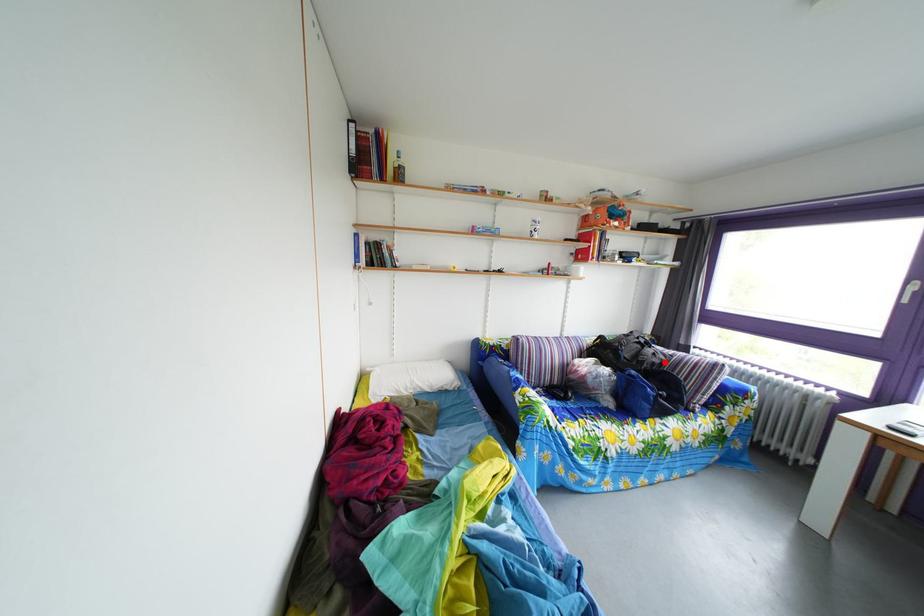
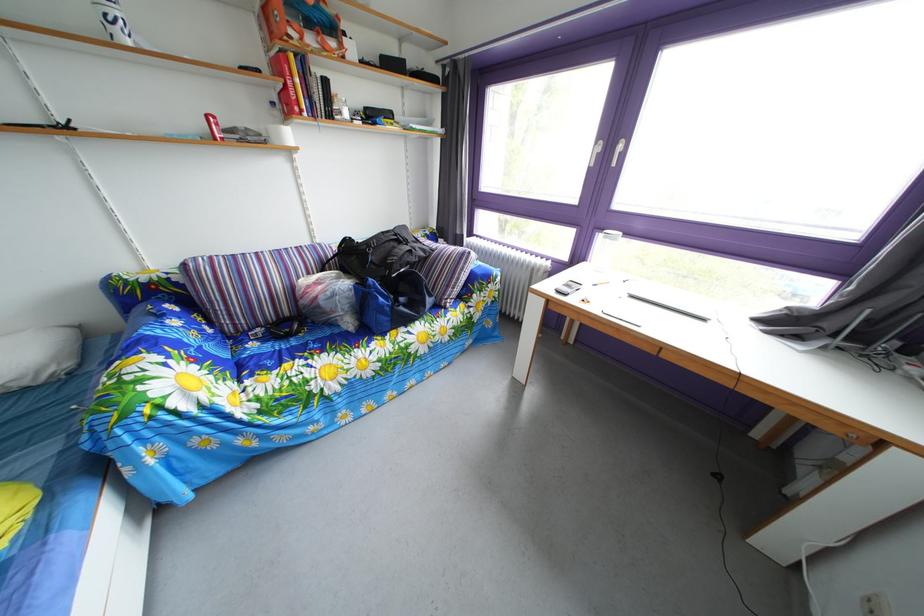
Question: I am providing you with two images of the same scene from different viewpoints. Given a red point in image1, look at the same physical point in image2. Is it:

Choices:
 (A) Closer to the viewpoint
 (B) Farther from the viewpoint

Answer: (A)